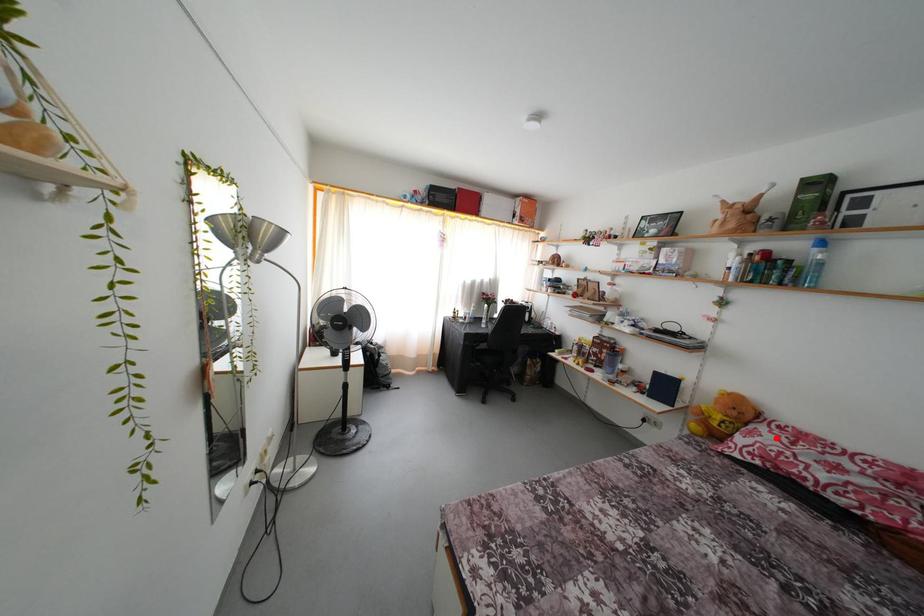
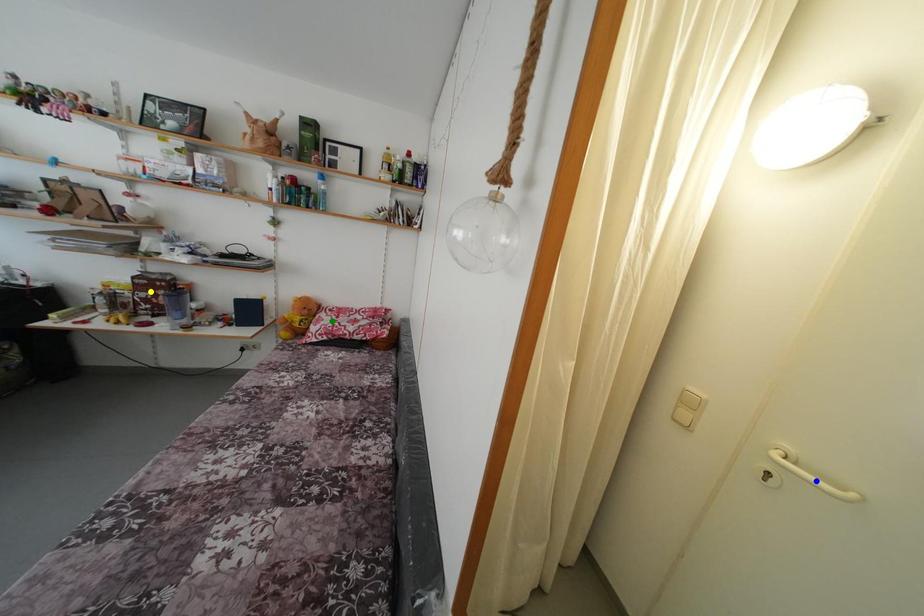
Question: I am providing you with two images of the same scene from different viewpoints. A red point is marked on the first image. You are given multiple points on the second image. Which point in image 2 represents the same 3d spot as the red point in image 1?

Choices:
 (A) green point
 (B) blue point
 (C) yellow point

Answer: (A)